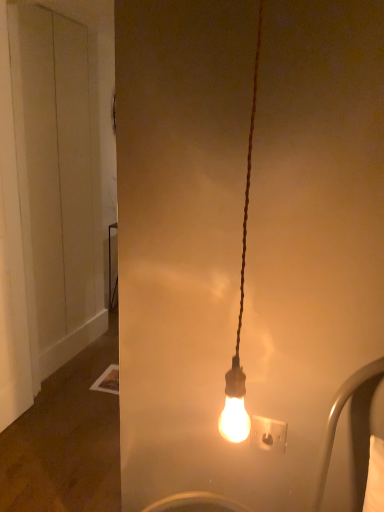
Question: Would you say white matte door at left is inside or outside white plastic socket at center?

Choices:
 (A) outside
 (B) inside

Answer: (A)

Question: From a real-world perspective, relative to white plastic socket at center, is white matte door at left vertically above or below?

Choices:
 (A) above
 (B) below

Answer: (A)

Question: In terms of height, does white matte door at left look taller or shorter compared to white plastic socket at center?

Choices:
 (A) short
 (B) tall

Answer: (B)

Question: Is white plastic socket at center in front of or behind white matte door at left in the image?

Choices:
 (A) front
 (B) behind

Answer: (A)

Question: In terms of height, does white plastic socket at center look taller or shorter compared to white matte door at left?

Choices:
 (A) short
 (B) tall

Answer: (A)

Question: Looking at their shapes, would you say white plastic socket at center is wider or thinner than white matte door at left?

Choices:
 (A) thin
 (B) wide

Answer: (A)

Question: Visually, is white plastic socket at center positioned to the left or to the right of white matte door at left?

Choices:
 (A) right
 (B) left

Answer: (A)